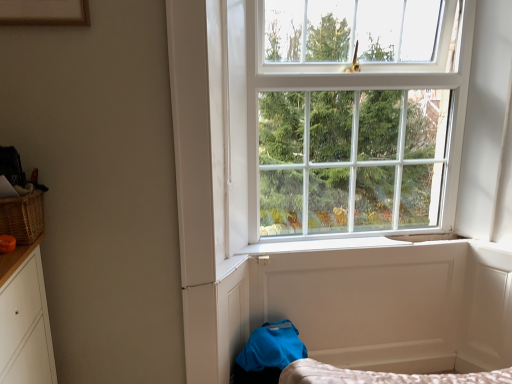
Image resolution: width=512 pixels, height=384 pixels. I want to click on blank space above white smooth window sill at center (from a real-world perspective), so click(345, 247).